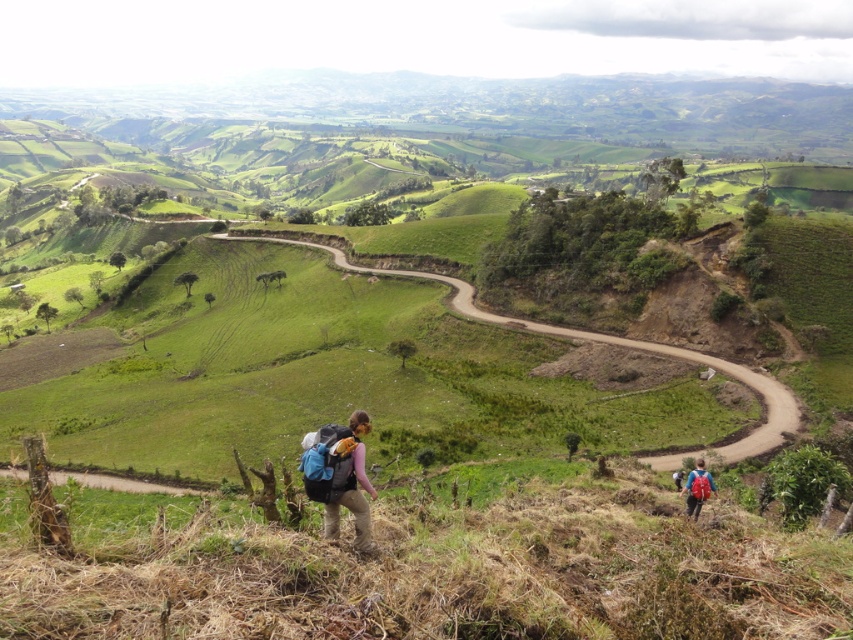
Question: Which object is closer to the camera taking this photo?

Choices:
 (A) matte blue backpack at lower right
 (B) matte blue backpack at center

Answer: (B)

Question: Does matte blue backpack at center appear under matte blue backpack at lower right?

Choices:
 (A) yes
 (B) no

Answer: (B)

Question: Does matte blue backpack at center have a smaller size compared to matte blue backpack at lower right?

Choices:
 (A) no
 (B) yes

Answer: (A)

Question: Where is matte blue backpack at center located in relation to matte blue backpack at lower right in the image?

Choices:
 (A) right
 (B) left

Answer: (B)

Question: Among these points, which one is nearest to the camera?

Choices:
 (A) (698, 496)
 (B) (346, 449)

Answer: (B)